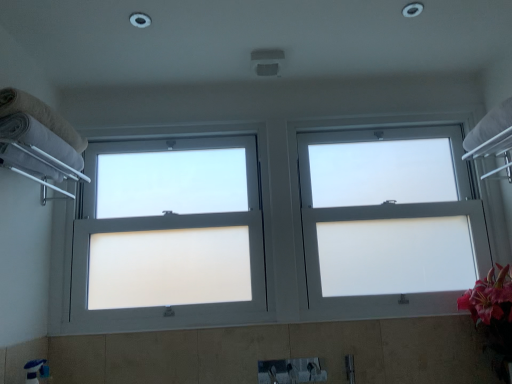
Question: Is point (115, 253) closer or farther from the camera than point (3, 102)?

Choices:
 (A) farther
 (B) closer

Answer: (A)

Question: Relative to beige cotton towel at left, arranged as the 1th towel when viewed from the top, is white frosted glass window at center, the 1th window viewed from the left, in front or behind?

Choices:
 (A) front
 (B) behind

Answer: (B)

Question: Which is nearer to the white frosted glass window at center, the 2th window when ordered from left to right?

Choices:
 (A) white frosted glass window at center, the 1th window viewed from the left
 (B) beige cotton towel at left, positioned as the 2th towel in bottom-to-top order
 (C) white fluffy towel at left, the second towel from the top

Answer: (A)

Question: Which object is the closest to the beige cotton towel at left, positioned as the 2th towel in bottom-to-top order?

Choices:
 (A) white frosted glass window at center, the 2th window when ordered from left to right
 (B) white fluffy towel at left, the first towel positioned from the bottom
 (C) white frosted glass window at center, the 1th window viewed from the left

Answer: (B)